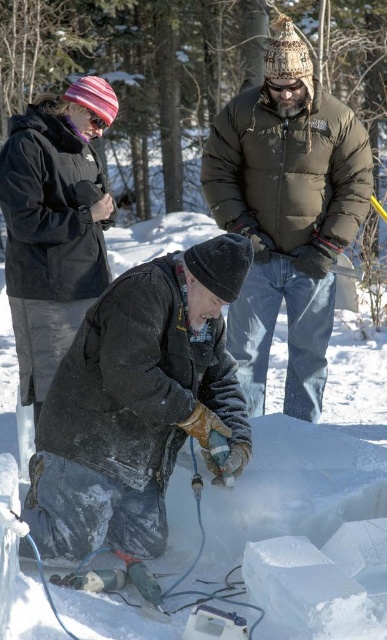
Question: Is dark brown leather gloves at center to the left of white frosty snow at center from the viewer's perspective?

Choices:
 (A) yes
 (B) no

Answer: (B)

Question: Which of these objects is positioned farthest from the dark brown leather gloves at center?

Choices:
 (A) dark green puffy jacket at center
 (B) white frosty snow at center

Answer: (A)

Question: Among these points, which one is farthest from the camera?

Choices:
 (A) (373, 413)
 (B) (241, 349)
 (C) (159, 392)

Answer: (A)

Question: Is dark brown leather gloves at center bigger than dark green puffy jacket at center?

Choices:
 (A) yes
 (B) no

Answer: (B)

Question: Based on their relative distances, which object is nearer to the dark green puffy jacket at center?

Choices:
 (A) dark brown leather gloves at center
 (B) white frosty snow at center

Answer: (A)

Question: Can you confirm if dark brown leather gloves at center is positioned above dark green puffy jacket at center?

Choices:
 (A) yes
 (B) no

Answer: (B)